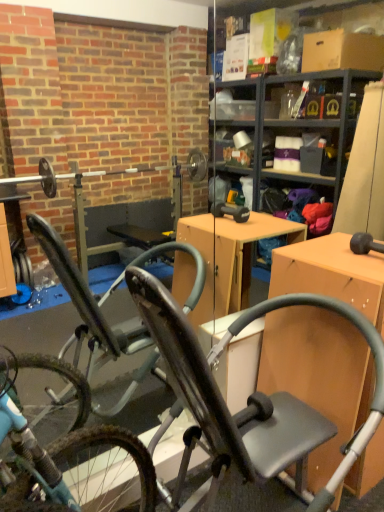
Question: Can you confirm if matte wood desk at right is wider than metallic gray exercise bike at center?

Choices:
 (A) yes
 (B) no

Answer: (B)

Question: From the image's perspective, is matte wood desk at right over metallic gray exercise bike at center?

Choices:
 (A) no
 (B) yes

Answer: (B)

Question: Does matte wood desk at right come behind metallic gray exercise bike at center?

Choices:
 (A) no
 (B) yes

Answer: (B)

Question: Considering the relative positions of matte wood desk at right and metallic gray exercise bike at center in the image provided, is matte wood desk at right to the left of metallic gray exercise bike at center from the viewer's perspective?

Choices:
 (A) no
 (B) yes

Answer: (A)

Question: Does matte wood desk at right have a lesser height compared to metallic gray exercise bike at center?

Choices:
 (A) yes
 (B) no

Answer: (A)

Question: Considering the relative sizes of matte wood desk at right and metallic gray exercise bike at center in the image provided, is matte wood desk at right smaller than metallic gray exercise bike at center?

Choices:
 (A) no
 (B) yes

Answer: (B)

Question: Is metallic gray exercise bike at center to the left of matte wood desk at right from the viewer's perspective?

Choices:
 (A) yes
 (B) no

Answer: (A)

Question: Is metallic gray exercise bike at center closer to camera compared to matte wood desk at right?

Choices:
 (A) no
 (B) yes

Answer: (B)

Question: Does metallic gray exercise bike at center have a lesser height compared to matte wood desk at right?

Choices:
 (A) yes
 (B) no

Answer: (B)

Question: Considering the relative sizes of metallic gray exercise bike at center and matte wood desk at right in the image provided, is metallic gray exercise bike at center wider than matte wood desk at right?

Choices:
 (A) yes
 (B) no

Answer: (A)

Question: Would you consider metallic gray exercise bike at center to be distant from matte wood desk at right?

Choices:
 (A) no
 (B) yes

Answer: (A)

Question: Is metallic gray exercise bike at center looking in the opposite direction of matte wood desk at right?

Choices:
 (A) no
 (B) yes

Answer: (A)

Question: Would you say matte wood desk at right is inside or outside metallic gray exercise bike at center?

Choices:
 (A) outside
 (B) inside

Answer: (A)